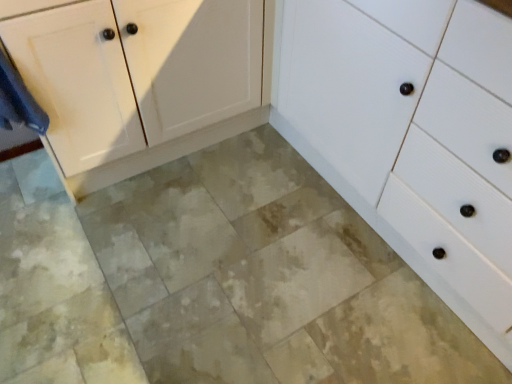
What do you see at coordinates (402, 143) in the screenshot?
I see `white matte cabinet at center` at bounding box center [402, 143].

Where is `white matte cabinet at center`? This screenshot has height=384, width=512. white matte cabinet at center is located at coordinates (402, 143).

Identify the location of white matte cabinet at center. (402, 143).